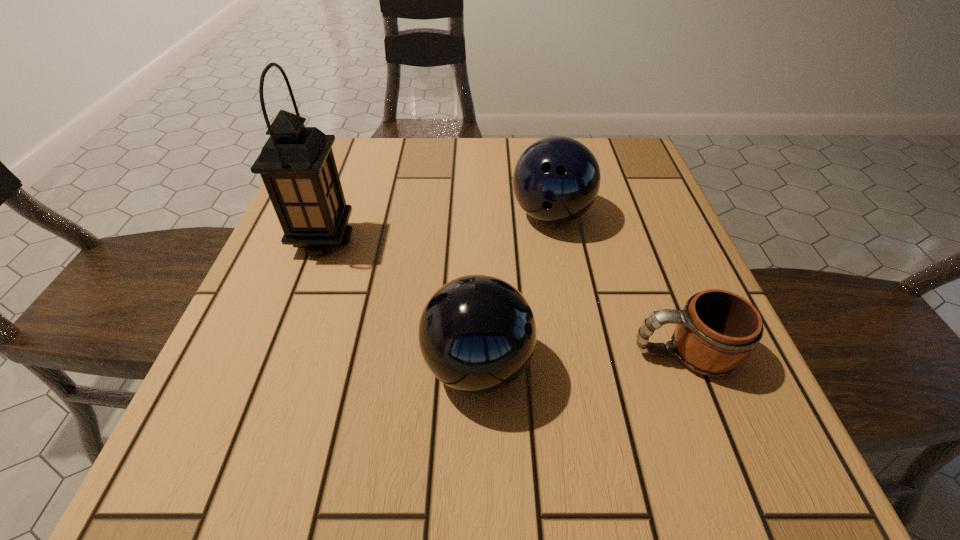
Where is `the tallest object`? Image resolution: width=960 pixels, height=540 pixels. the tallest object is located at coordinates (297, 165).

Where is `the leftmost object`? Image resolution: width=960 pixels, height=540 pixels. the leftmost object is located at coordinates (297, 165).

The height and width of the screenshot is (540, 960). Find the location of `the farther bowling ball`. the farther bowling ball is located at coordinates (556, 180).

Locate an element on the screen. The width and height of the screenshot is (960, 540). the nearer bowling ball is located at coordinates pos(477,334).

What are the coordinates of `mug` in the screenshot? It's located at (717, 330).

The width and height of the screenshot is (960, 540). In order to click on the rightmost object in this screenshot , I will do [717, 330].

Find the location of a particular element. free spot located 0.140m on the back of the lantern is located at coordinates (345, 182).

Identify the location of vacant space located on the surface of the farther bowling ball near the finger holes. (582, 384).

This screenshot has height=540, width=960. I want to click on free space located 0.170m on the side of the nearer bowling ball with the finger holes, so click(x=645, y=366).

Where is `vacant region located on the side of the shortest object with the handle`? This screenshot has width=960, height=540. vacant region located on the side of the shortest object with the handle is located at coordinates (376, 353).